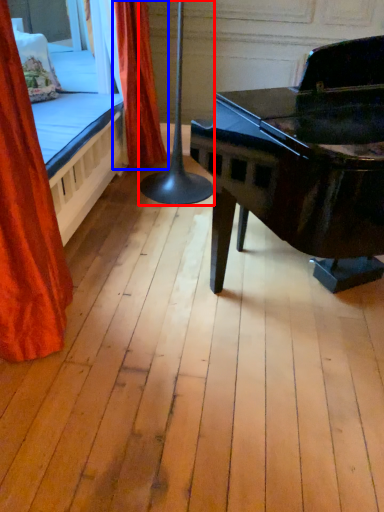
Question: Which point is closer to the camera, table lamp (highlighted by a red box) or curtain (highlighted by a blue box)?

Choices:
 (A) table lamp
 (B) curtain

Answer: (A)